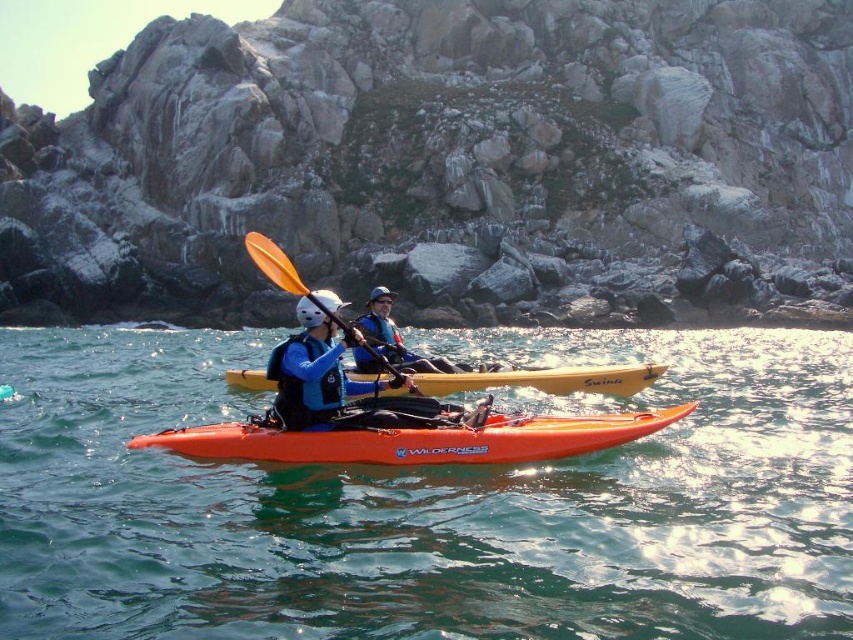
Question: Is translucent orange kayak at center thinner than matte blue life vest at center?

Choices:
 (A) yes
 (B) no

Answer: (B)

Question: Among these objects, which one is nearest to the camera?

Choices:
 (A) matte blue jacket at center
 (B) matte blue life vest at center
 (C) orange plastic paddle at center
 (D) yellow matte kayak at center

Answer: (C)

Question: Does smooth gray rock at center have a greater width compared to orange plastic paddle at center?

Choices:
 (A) no
 (B) yes

Answer: (B)

Question: Can you confirm if matte blue life vest at center is smaller than matte blue jacket at center?

Choices:
 (A) no
 (B) yes

Answer: (A)

Question: Which point appears closest to the camera in this image?

Choices:
 (A) (729, 490)
 (B) (273, 380)

Answer: (A)

Question: Which object is the farthest from the orange plastic paddle at center?

Choices:
 (A) smooth gray rock at center
 (B) translucent orange kayak at center
 (C) matte blue jacket at center
 (D) orange matte kayak at center

Answer: (A)